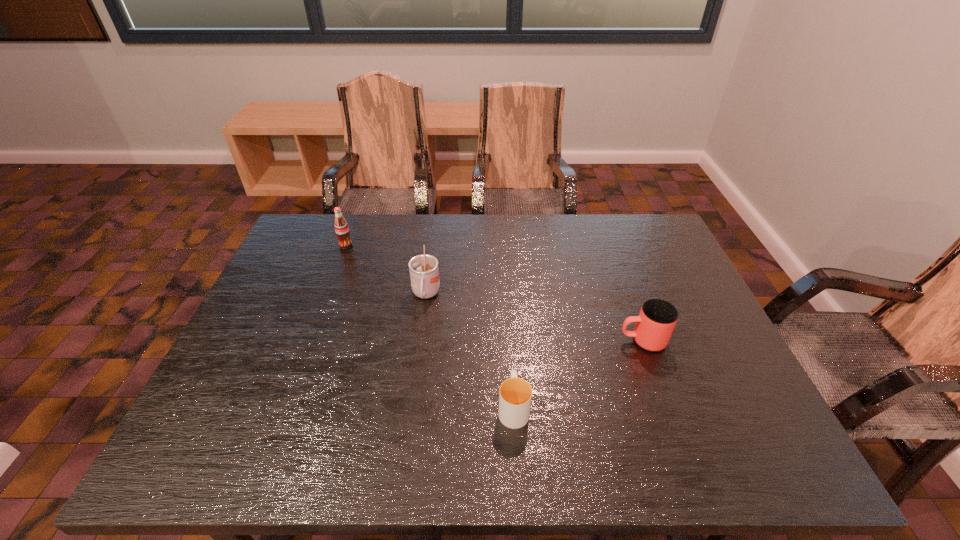
Find the location of `free spot located on the handle side of the second shortest cup`. free spot located on the handle side of the second shortest cup is located at coordinates coord(511,341).

Where is `vacant space positioned on the handle side of the second shortest cup`? The height and width of the screenshot is (540, 960). vacant space positioned on the handle side of the second shortest cup is located at coordinates (535, 341).

Locate an element on the screen. The height and width of the screenshot is (540, 960). vacant area situated 0.370m on the handle side of the second shortest cup is located at coordinates (470, 341).

I want to click on vacant space located with the handle on the side of the nearest cup, so click(508, 314).

Find the location of a particular element. The image size is (960, 540). vacant space located 0.160m with the handle on the side of the nearest cup is located at coordinates (509, 334).

Locate an element on the screen. The image size is (960, 540). vacant space located with the handle on the side of the nearest cup is located at coordinates (507, 306).

In order to click on object that is at the far edge in this screenshot , I will do point(341,227).

Locate an element on the screen. This screenshot has width=960, height=540. object that is at the near edge is located at coordinates (515, 394).

This screenshot has height=540, width=960. Identify the location of object that is at the left edge. (341, 227).

The width and height of the screenshot is (960, 540). I want to click on object located in the right edge section of the desktop, so click(657, 318).